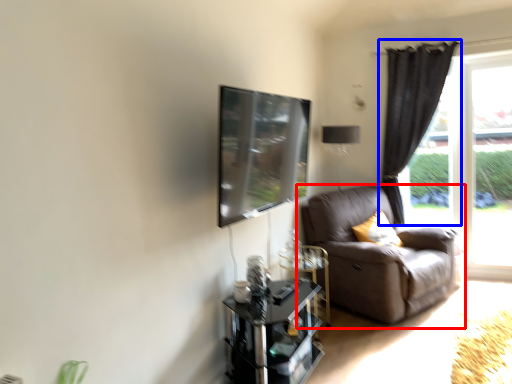
Question: Which of the following is the farthest to the observer, studio couch (highlighted by a red box) or curtain (highlighted by a blue box)?

Choices:
 (A) studio couch
 (B) curtain

Answer: (B)